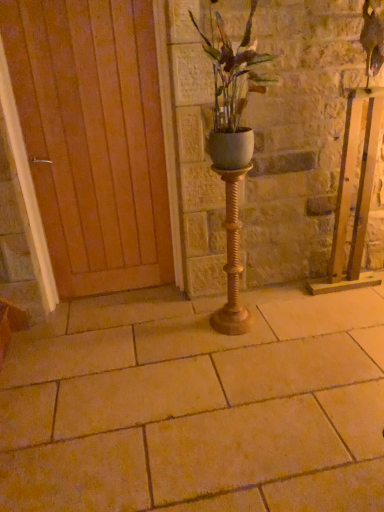
Identify the location of vacant location below wooden at left (from a real-world perspective). Image resolution: width=384 pixels, height=512 pixels. (115, 297).